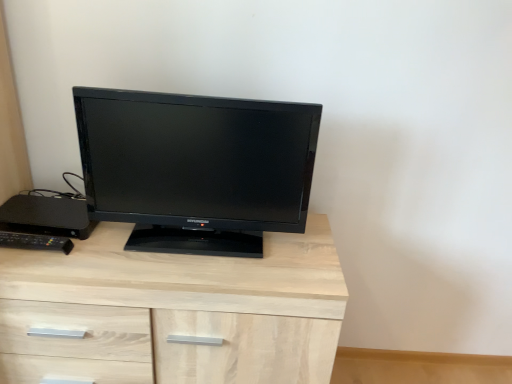
Question: In the image, is black plastic desktop at left, the second desktop in the front-to-back sequence, on the left side or the right side of black plastic remote control at left, which is counted as the 2th desktop, starting from the back?

Choices:
 (A) right
 (B) left

Answer: (B)

Question: In terms of size, does black plastic desktop at left, the second desktop in the front-to-back sequence, appear bigger or smaller than black plastic remote control at left, which is the first desktop from front to back?

Choices:
 (A) big
 (B) small

Answer: (A)

Question: Which object is positioned closest to the light wood chest of drawers at center?

Choices:
 (A) black glossy monitor at center
 (B) black plastic remote control at left, which is the first desktop from front to back
 (C) black plastic desktop at left, acting as the first desktop starting from the back

Answer: (A)

Question: Which is nearer to the black plastic desktop at left, the second desktop in the front-to-back sequence?

Choices:
 (A) black plastic remote control at left, which is the first desktop from front to back
 (B) black glossy monitor at center
 (C) light wood chest of drawers at center

Answer: (A)